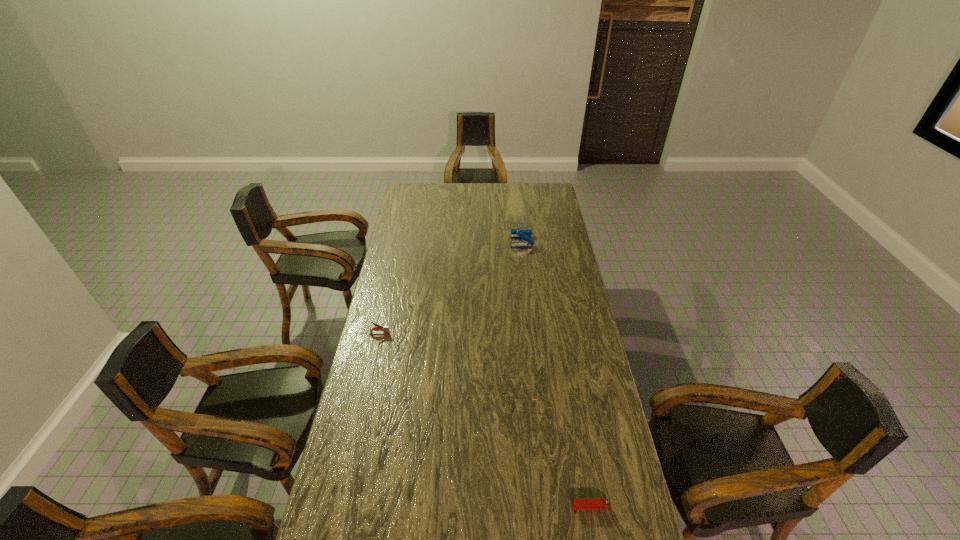
The width and height of the screenshot is (960, 540). I want to click on vacant position located on the temples of the third farthest object, so click(396, 386).

Locate an element on the screen. free spot located 0.290m on the temples of the third farthest object is located at coordinates (422, 386).

At what (x,y) coordinates should I click in order to perform the action: click on vacant region located on the temples of the third farthest object. Please return your answer as a coordinate pair (x, y). The image size is (960, 540). Looking at the image, I should click on (417, 386).

Find the location of a particular element. Image resolution: width=960 pixels, height=540 pixels. free location located 0.230m on the front-facing side of the nearest object is located at coordinates pos(493,507).

Where is `free spot located 0.190m on the front-facing side of the nearest object`? The width and height of the screenshot is (960, 540). free spot located 0.190m on the front-facing side of the nearest object is located at coordinates click(507, 507).

Identify the location of free location located on the front-facing side of the nearest object. The image size is (960, 540). (460, 507).

You are a GUI agent. You are given a task and a screenshot of the screen. Output one action in this format:
    pyautogui.click(x=<x>, y=<y>)
    Task: Click on the object present at the left edge
    This screenshot has width=960, height=540.
    Given the screenshot: What is the action you would take?
    pyautogui.click(x=385, y=329)

Identify the location of object that is at the right edge. The width and height of the screenshot is (960, 540). (585, 503).

Find the location of `free spot at the far edge of the desktop`. free spot at the far edge of the desktop is located at coordinates (518, 190).

Locate an element on the screen. vacant space at the left edge is located at coordinates (358, 384).